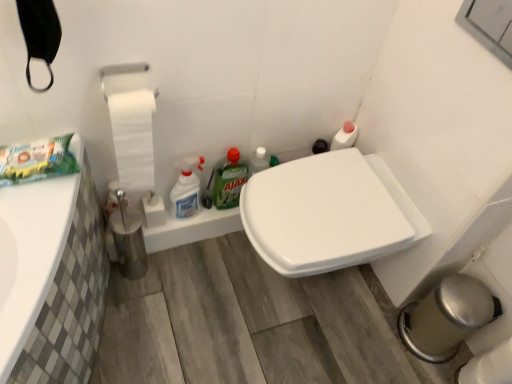
What is the approximate height of white matte toilet paper at left?

The height of white matte toilet paper at left is 16.05 inches.

Image resolution: width=512 pixels, height=384 pixels. What do you see at coordinates (328, 213) in the screenshot?
I see `white glossy toilet seat at center` at bounding box center [328, 213].

This screenshot has width=512, height=384. What do you see at coordinates (186, 187) in the screenshot?
I see `white glossy spray bottle at center, arranged as the second cleaning product when viewed from the right` at bounding box center [186, 187].

What do you see at coordinates (229, 180) in the screenshot? The height and width of the screenshot is (384, 512). I see `green matte ajax at center, arranged as the 2th cleaning product when viewed from the left` at bounding box center [229, 180].

In order to click on white matte toilet paper at left in this screenshot , I will do `click(133, 138)`.

Find the location of a particular element. toilet paper in front of the white glossy spray bottle at center, the first cleaning product in the left-to-right sequence is located at coordinates (133, 138).

Which is more to the left, white glossy spray bottle at center, the first cleaning product in the left-to-right sequence, or white matte toilet paper at left?

white matte toilet paper at left is more to the left.

Is point (187, 204) closer or farther from the camera than point (141, 95)?

Point (187, 204) is positioned farther from the camera compared to point (141, 95).

Would you say white glossy spray bottle at center, arranged as the second cleaning product when viewed from the right, is inside or outside white glossy toilet seat at center?

white glossy spray bottle at center, arranged as the second cleaning product when viewed from the right, is located beyond the bounds of white glossy toilet seat at center.

Measure the distance from white glossy spray bottle at center, arranged as the second cleaning product when viewed from the right, to white glossy toilet seat at center.

A distance of 43.66 centimeters exists between white glossy spray bottle at center, arranged as the second cleaning product when viewed from the right, and white glossy toilet seat at center.

Considering the positions of objects white glossy spray bottle at center, the first cleaning product in the left-to-right sequence, and white glossy toilet seat at center in the image provided, who is behind, white glossy spray bottle at center, the first cleaning product in the left-to-right sequence, or white glossy toilet seat at center?

white glossy spray bottle at center, the first cleaning product in the left-to-right sequence, is further from the camera.

Considering the sizes of white glossy spray bottle at center, arranged as the second cleaning product when viewed from the right, and white glossy toilet seat at center in the image, is white glossy spray bottle at center, arranged as the second cleaning product when viewed from the right, taller or shorter than white glossy toilet seat at center?

Considering their sizes, white glossy spray bottle at center, arranged as the second cleaning product when viewed from the right, has less height than white glossy toilet seat at center.

From the image's perspective, between white glossy spray bottle at center, arranged as the second cleaning product when viewed from the right, and green matte ajax at center, the first cleaning product when ordered from right to left, which one is located above?

green matte ajax at center, the first cleaning product when ordered from right to left.

Can you confirm if white glossy spray bottle at center, arranged as the second cleaning product when viewed from the right, is thinner than green matte ajax at center, arranged as the 2th cleaning product when viewed from the left?

No, white glossy spray bottle at center, arranged as the second cleaning product when viewed from the right, is not thinner than green matte ajax at center, arranged as the 2th cleaning product when viewed from the left.

Who is shorter, white glossy spray bottle at center, the first cleaning product in the left-to-right sequence, or green matte ajax at center, the first cleaning product when ordered from right to left?

With less height is green matte ajax at center, the first cleaning product when ordered from right to left.

Is white glossy toilet seat at center positioned behind green matte ajax at center, the first cleaning product when ordered from right to left?

No.

Looking at this image, can you confirm if white glossy toilet seat at center is shorter than green matte ajax at center, the first cleaning product when ordered from right to left?

In fact, white glossy toilet seat at center may be taller than green matte ajax at center, the first cleaning product when ordered from right to left.

From a real-world perspective, which is physically above, white glossy toilet seat at center or green matte ajax at center, the first cleaning product when ordered from right to left?

green matte ajax at center, the first cleaning product when ordered from right to left, is physically above.

Is white matte toilet paper at left completely or partially inside white glossy toilet seat at center?

No, white matte toilet paper at left is not inside white glossy toilet seat at center.

From a real-world perspective, is white glossy toilet seat at center on white matte toilet paper at left?

Incorrect, from a real-world perspective, white glossy toilet seat at center is lower than white matte toilet paper at left.

Is there a large distance between white glossy toilet seat at center and white matte toilet paper at left?

No.

Who is shorter, white glossy toilet seat at center or white matte toilet paper at left?

white glossy toilet seat at center is shorter.

Considering the relative sizes of green matte ajax at center, the first cleaning product when ordered from right to left, and white matte toilet paper at left in the image provided, is green matte ajax at center, the first cleaning product when ordered from right to left, bigger than white matte toilet paper at left?

Incorrect, green matte ajax at center, the first cleaning product when ordered from right to left, is not larger than white matte toilet paper at left.

This screenshot has width=512, height=384. Find the location of `cleaning product that is the 2nd object located behind the white matte toilet paper at left`. cleaning product that is the 2nd object located behind the white matte toilet paper at left is located at coordinates (229, 180).

Would you consider green matte ajax at center, arranged as the 2th cleaning product when viewed from the left, to be distant from white matte toilet paper at left?

They are positioned close to each other.

Does green matte ajax at center, arranged as the 2th cleaning product when viewed from the left, turn towards white matte toilet paper at left?

No.

Between green matte ajax at center, arranged as the 2th cleaning product when viewed from the left, and white glossy toilet seat at center, which one has larger width?

white glossy toilet seat at center is wider.

In the image, is green matte ajax at center, the first cleaning product when ordered from right to left, positioned in front of or behind white glossy toilet seat at center?

In the image, green matte ajax at center, the first cleaning product when ordered from right to left, appears behind white glossy toilet seat at center.

Does green matte ajax at center, the first cleaning product when ordered from right to left, have a greater height compared to white glossy toilet seat at center?

No, green matte ajax at center, the first cleaning product when ordered from right to left, is not taller than white glossy toilet seat at center.

From the image's perspective, starting from the white glossy toilet seat at center, which cleaning product is the 2nd one above? Please provide its 2D coordinates.

[(229, 180)]

From the image's perspective, which cleaning product is the 2nd one below the white matte toilet paper at left? Please provide its 2D coordinates.

[(186, 187)]

From the image's perspective, starting from the white glossy toilet seat at center, which cleaning product is the 1st one above? Please provide its 2D coordinates.

[(186, 187)]

Based on their spatial positions, is white glossy toilet seat at center or white matte toilet paper at left further from green matte ajax at center, arranged as the 2th cleaning product when viewed from the left?

white glossy toilet seat at center is further to green matte ajax at center, arranged as the 2th cleaning product when viewed from the left.

Based on their spatial positions, is white matte toilet paper at left or white glossy spray bottle at center, arranged as the second cleaning product when viewed from the right, further from green matte ajax at center, arranged as the 2th cleaning product when viewed from the left?

white matte toilet paper at left is positioned further to the anchor green matte ajax at center, arranged as the 2th cleaning product when viewed from the left.

Looking at the image, which one is located further to white matte toilet paper at left, white glossy spray bottle at center, the first cleaning product in the left-to-right sequence, or green matte ajax at center, arranged as the 2th cleaning product when viewed from the left?

The object further to white matte toilet paper at left is green matte ajax at center, arranged as the 2th cleaning product when viewed from the left.

Looking at this image, estimate the real-world distances between objects in this image. Which object is closer to green matte ajax at center, arranged as the 2th cleaning product when viewed from the left, white glossy spray bottle at center, arranged as the second cleaning product when viewed from the right, or white matte toilet paper at left?

The object closer to green matte ajax at center, arranged as the 2th cleaning product when viewed from the left, is white glossy spray bottle at center, arranged as the second cleaning product when viewed from the right.

Based on their spatial positions, is white matte toilet paper at left or white glossy toilet seat at center closer to white glossy spray bottle at center, the first cleaning product in the left-to-right sequence?

The object closer to white glossy spray bottle at center, the first cleaning product in the left-to-right sequence, is white matte toilet paper at left.

From the image, which object appears to be nearer to white glossy spray bottle at center, the first cleaning product in the left-to-right sequence, green matte ajax at center, the first cleaning product when ordered from right to left, or white matte toilet paper at left?

Based on the image, green matte ajax at center, the first cleaning product when ordered from right to left, appears to be nearer to white glossy spray bottle at center, the first cleaning product in the left-to-right sequence.

Looking at the image, which one is located closer to white matte toilet paper at left, green matte ajax at center, the first cleaning product when ordered from right to left, or white glossy spray bottle at center, the first cleaning product in the left-to-right sequence?

white glossy spray bottle at center, the first cleaning product in the left-to-right sequence.

Estimate the real-world distances between objects in this image. Which object is further from green matte ajax at center, the first cleaning product when ordered from right to left, white glossy spray bottle at center, arranged as the second cleaning product when viewed from the right, or white glossy toilet seat at center?

Based on the image, white glossy toilet seat at center appears to be further to green matte ajax at center, the first cleaning product when ordered from right to left.

Identify the location of cleaning product between white matte toilet paper at left and green matte ajax at center, arranged as the 2th cleaning product when viewed from the left, in the front-back direction. The width and height of the screenshot is (512, 384). click(x=186, y=187).

Locate an element on the screen. The width and height of the screenshot is (512, 384). cleaning product located between white glossy spray bottle at center, arranged as the second cleaning product when viewed from the right, and white glossy toilet seat at center in the left-right direction is located at coordinates (229, 180).